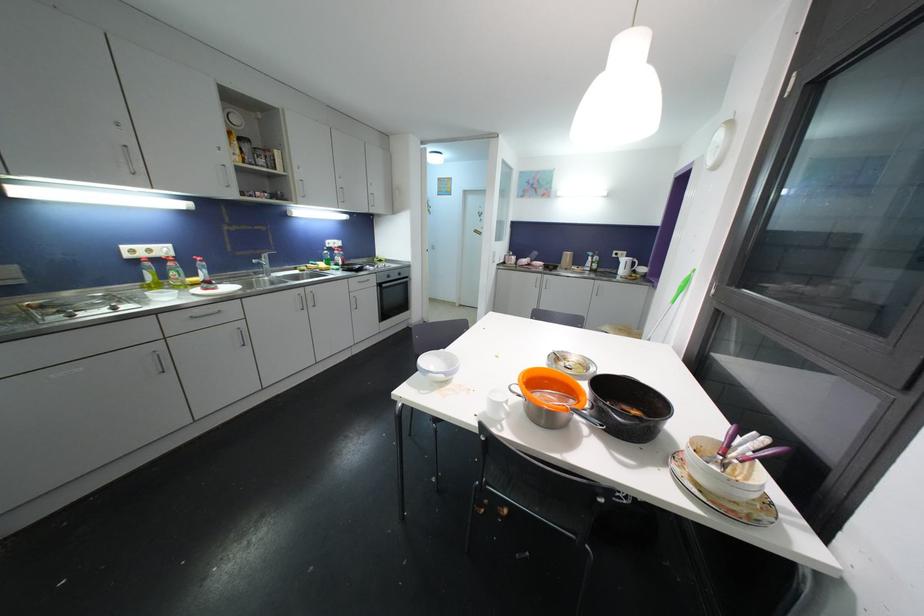
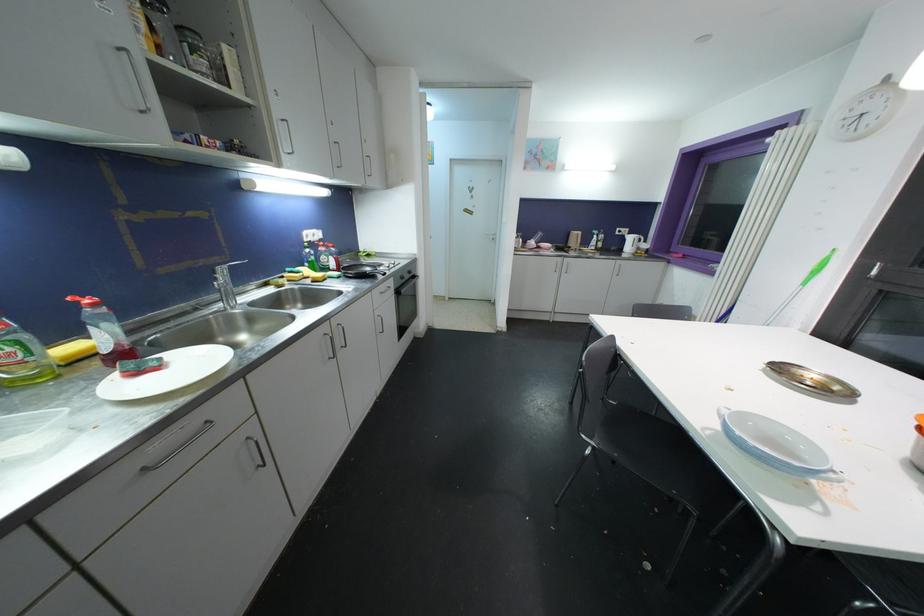
In the second image, find the point that corresponds to point (627, 264) in the first image.

(634, 241)